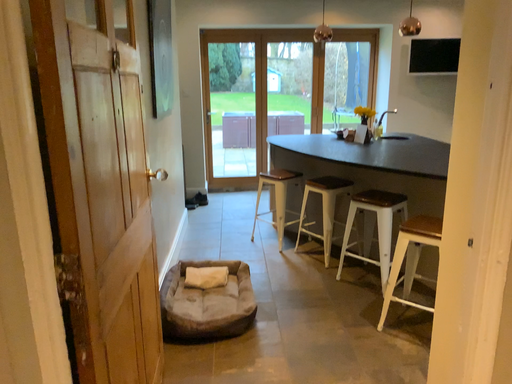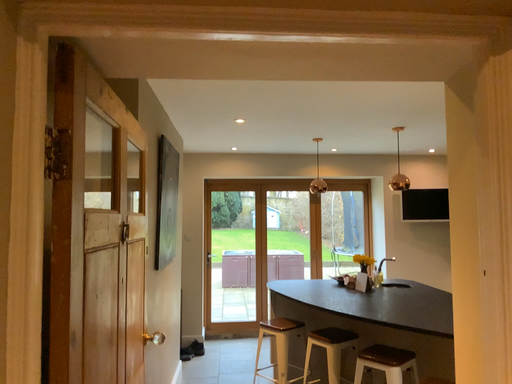
Question: Which way did the camera rotate in the video?

Choices:
 (A) rotated downward
 (B) rotated upward

Answer: (B)